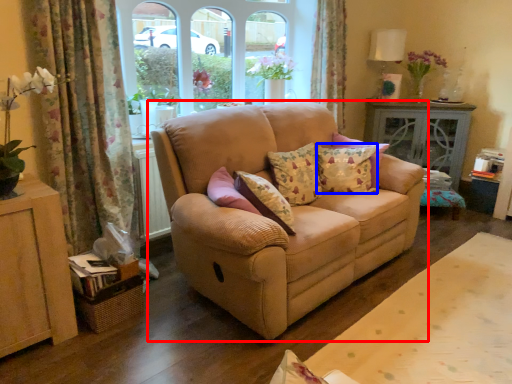
Question: Which of the following is the farthest to the observer, studio couch (highlighted by a red box) or pillow (highlighted by a blue box)?

Choices:
 (A) studio couch
 (B) pillow

Answer: (B)